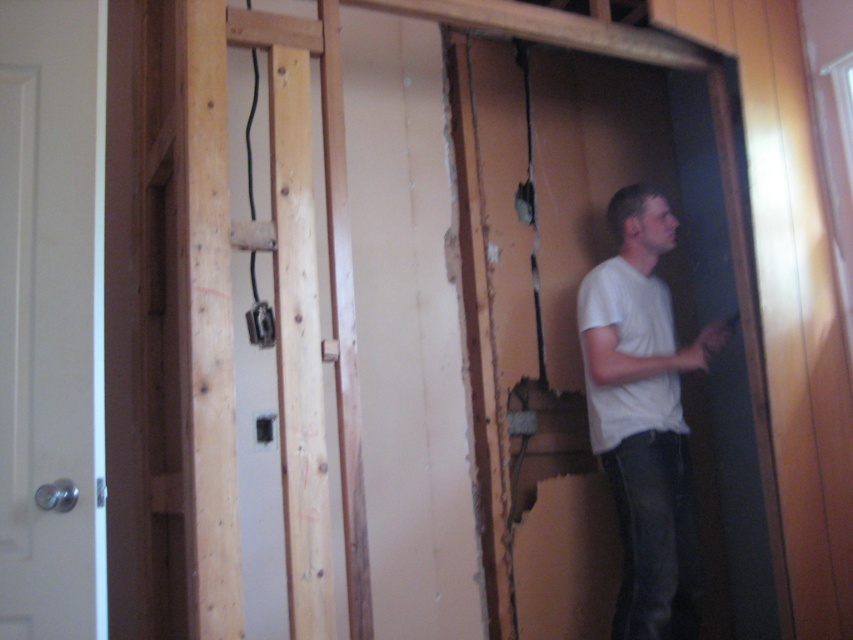
In the scene shown: You are standing in the doorway of the room and notice two points marked on the wall. The first point is at coordinates point (91, 538) and the second is at point (654, 308). Which point is closer to you?

Point (91, 538) is closer to the viewer than point (654, 308).

You are a contractor assessing the room. You notice the white matte door at left and the white cotton shirt at right. Which object is shorter in height?

The white matte door at left is shorter in height compared to the white cotton shirt at right according to the description.

You are a contractor holding a 1.5 meter long ladder. You need to move it through the white matte door at left while standing near the white matte shirt at center. Can you fit the ladder through the door without tilting it?

The distance between the white matte door at left and white matte shirt at center is 1.49 meters. Since the ladder is 1.5 meters long, it cannot be moved through the door without tilting because the available space is slightly shorter than the ladder.